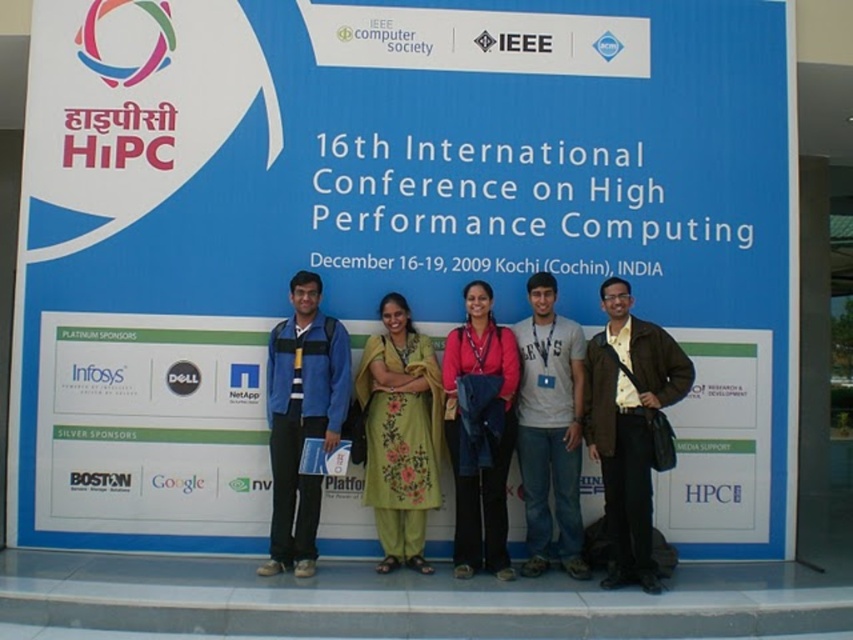
Does brown leather jacket at center have a smaller size compared to green floral dress at center?

Actually, brown leather jacket at center might be larger than green floral dress at center.

Can you confirm if brown leather jacket at center is wider than green floral dress at center?

Indeed, brown leather jacket at center has a greater width compared to green floral dress at center.

Which is in front, point (628, 362) or point (379, 570)?

Point (628, 362) is more forward.

This screenshot has height=640, width=853. What are the coordinates of `brown leather jacket at center` in the screenshot? It's located at (628, 426).

Can you confirm if green floral dress at center is positioned to the right of gray cotton t-shirt at center?

In fact, green floral dress at center is to the left of gray cotton t-shirt at center.

Does point (424, 515) come farther from viewer compared to point (567, 330)?

No, (424, 515) is closer to viewer.

You are a GUI agent. You are given a task and a screenshot of the screen. Output one action in this format:
    pyautogui.click(x=<x>, y=<y>)
    Task: Click on the green floral dress at center
    This screenshot has height=640, width=853.
    Given the screenshot: What is the action you would take?
    pyautogui.click(x=399, y=433)

Who is taller, green floral dress at center or pink fabric dress at center?

Standing taller between the two is pink fabric dress at center.

Can you confirm if green floral dress at center is smaller than pink fabric dress at center?

Yes.

The width and height of the screenshot is (853, 640). In order to click on green floral dress at center in this screenshot , I will do `click(399, 433)`.